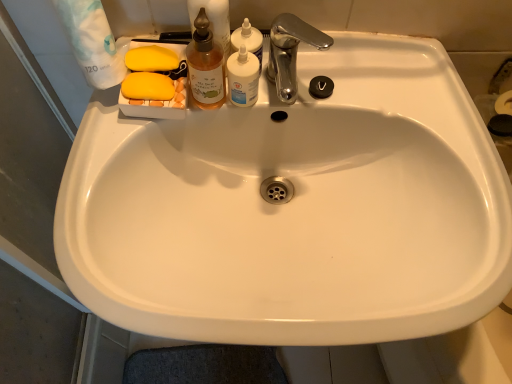
This screenshot has height=384, width=512. I want to click on vacant area located to the right-hand side of chrome metallic faucet at upper center, so click(392, 90).